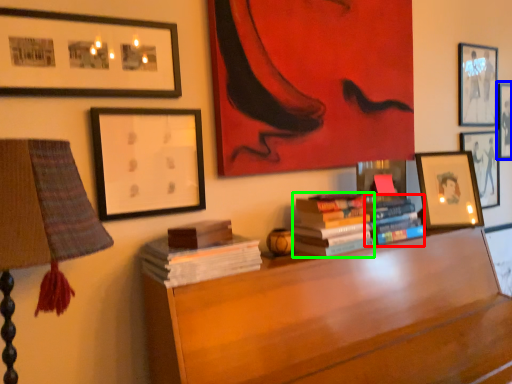
Question: Based on their relative distances, which object is farther from book (highlighted by a red box)? Choose from picture frame (highlighted by a blue box) and book (highlighted by a green box).

Choices:
 (A) picture frame
 (B) book

Answer: (A)